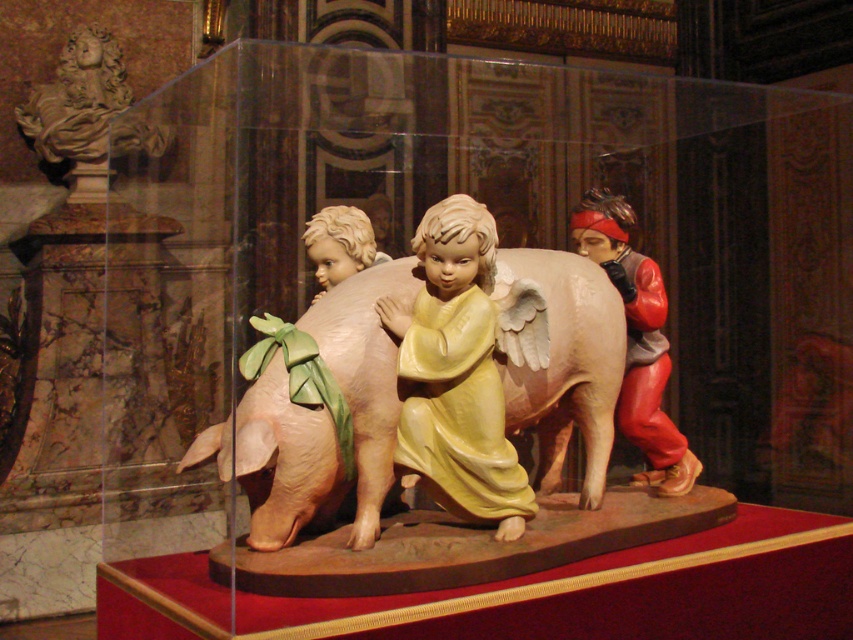
You are a museum visitor observing the sculpture. The matte yellow angel at center and the smooth beige pig at center are part of the artwork. Based on their positions, which object is placed higher in the sculpture?

The smooth beige pig at center is placed higher than the matte yellow angel at center because the matte yellow angel at center is positioned under the smooth beige pig at center.